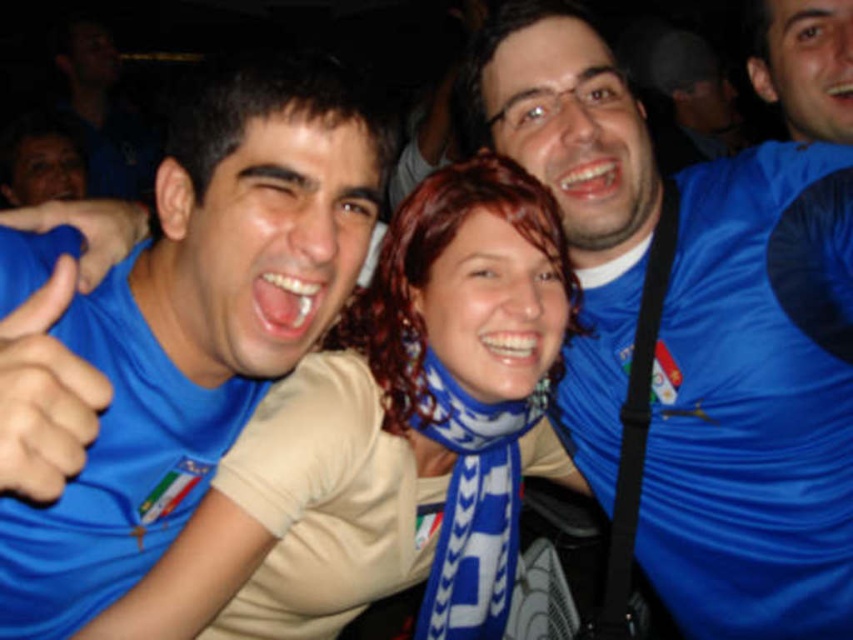
Is blue jersey at center taller than blue fabric thumb at left?

Yes.

Does blue jersey at center have a larger size compared to blue fabric thumb at left?

Correct, blue jersey at center is larger in size than blue fabric thumb at left.

Locate an element on the screen. The image size is (853, 640). blue jersey at center is located at coordinates (755, 401).

Is point (314, 433) positioned before point (83, 230)?

No, it is not.

Which is behind, point (378, 349) or point (100, 225)?

The point (378, 349) is more distant.

In order to click on white textured scarf at center in this screenshot , I will do `click(398, 404)`.

Image resolution: width=853 pixels, height=640 pixels. I want to click on blue jersey at center, so click(755, 401).

Can you confirm if blue jersey at center is thinner than white textured scarf at center?

Correct, blue jersey at center's width is less than white textured scarf at center's.

Find the location of a particular element. blue jersey at center is located at coordinates (755, 401).